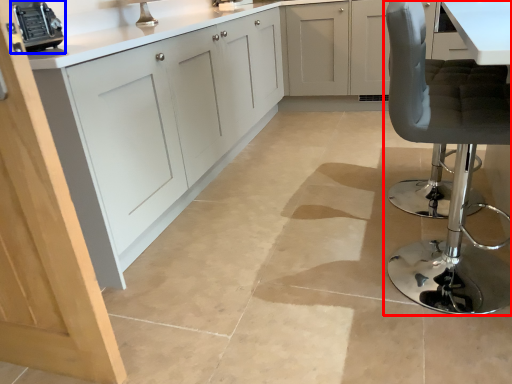
Question: Which point is further to the camera, chair (highlighted by a red box) or appliance (highlighted by a blue box)?

Choices:
 (A) chair
 (B) appliance

Answer: (B)